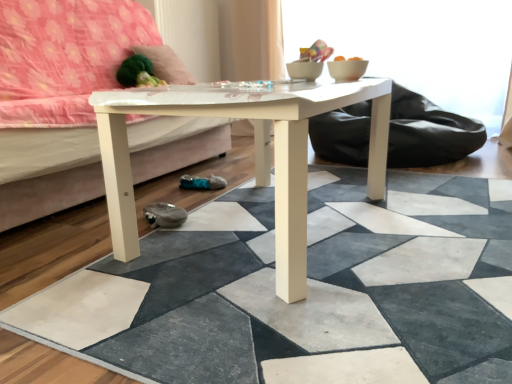
Question: Can you confirm if white glossy coffee table at center is shorter than velvety green pillow at upper left?

Choices:
 (A) yes
 (B) no

Answer: (B)

Question: Does white glossy coffee table at center come in front of velvety green pillow at upper left?

Choices:
 (A) yes
 (B) no

Answer: (A)

Question: Is white glossy coffee table at center to the left of velvety green pillow at upper left from the viewer's perspective?

Choices:
 (A) yes
 (B) no

Answer: (B)

Question: From the image's perspective, is white glossy coffee table at center located above velvety green pillow at upper left?

Choices:
 (A) yes
 (B) no

Answer: (B)

Question: Does white glossy coffee table at center lie behind velvety green pillow at upper left?

Choices:
 (A) yes
 (B) no

Answer: (B)

Question: Considering the positions of white glossy coffee table at center and white matte tile at center in the image, is white glossy coffee table at center taller or shorter than white matte tile at center?

Choices:
 (A) short
 (B) tall

Answer: (B)

Question: Is white glossy coffee table at center inside the boundaries of white matte tile at center, or outside?

Choices:
 (A) inside
 (B) outside

Answer: (B)

Question: In terms of size, does white glossy coffee table at center appear bigger or smaller than white matte tile at center?

Choices:
 (A) small
 (B) big

Answer: (B)

Question: Looking at their shapes, would you say white glossy coffee table at center is wider or thinner than white matte tile at center?

Choices:
 (A) thin
 (B) wide

Answer: (A)

Question: In the image, is velvety green pillow at upper left on the left side or the right side of white glossy coffee table at center?

Choices:
 (A) left
 (B) right

Answer: (A)

Question: Is point (147, 56) closer or farther from the camera than point (120, 180)?

Choices:
 (A) farther
 (B) closer

Answer: (A)

Question: In terms of size, does velvety green pillow at upper left appear bigger or smaller than white glossy coffee table at center?

Choices:
 (A) big
 (B) small

Answer: (B)

Question: Is velvety green pillow at upper left taller or shorter than white glossy coffee table at center?

Choices:
 (A) tall
 (B) short

Answer: (B)

Question: In terms of size, does white glossy studio couch at center appear bigger or smaller than white matte tile at center?

Choices:
 (A) big
 (B) small

Answer: (A)

Question: From the image's perspective, is white glossy studio couch at center located above or below white matte tile at center?

Choices:
 (A) above
 (B) below

Answer: (A)